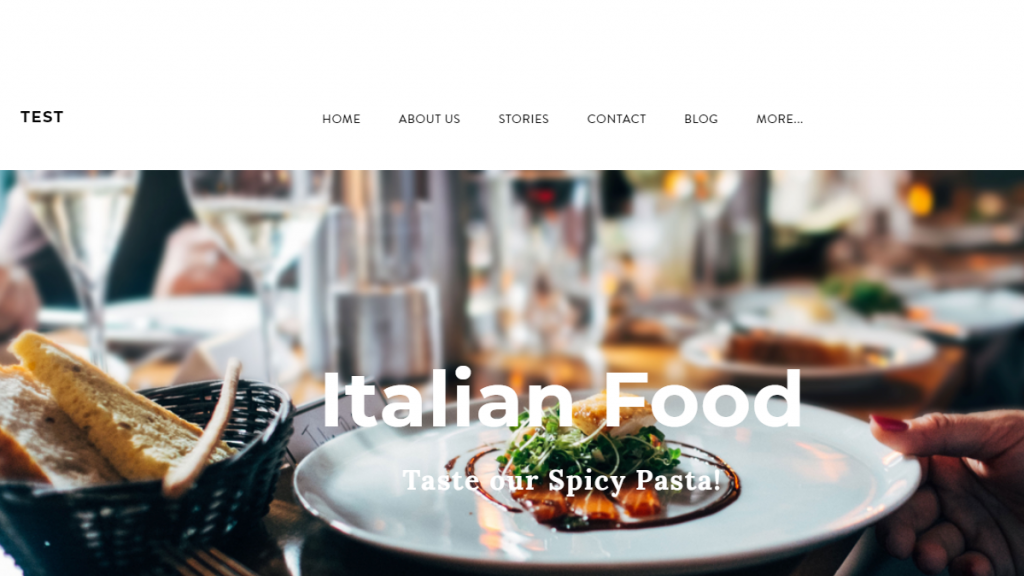
Where is `water glass`? This screenshot has width=1024, height=576. water glass is located at coordinates (554, 245), (658, 237).